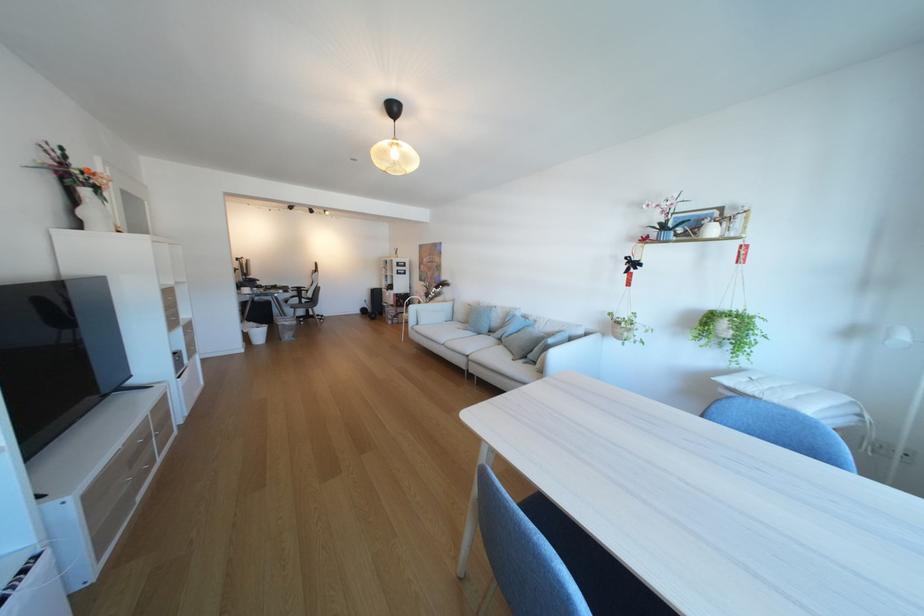
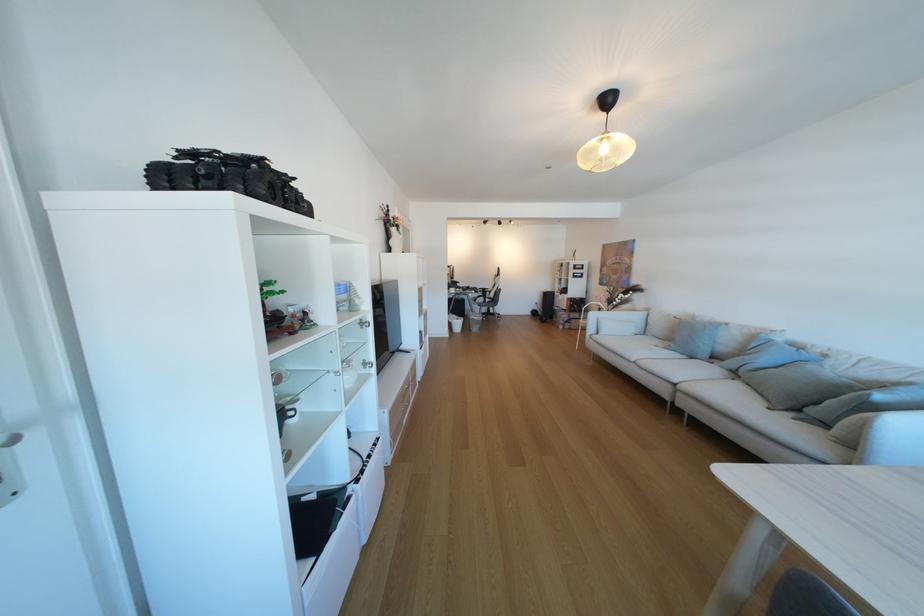
The point at (509,346) is marked in the first image. Where is the corresponding point in the second image?

(745, 381)